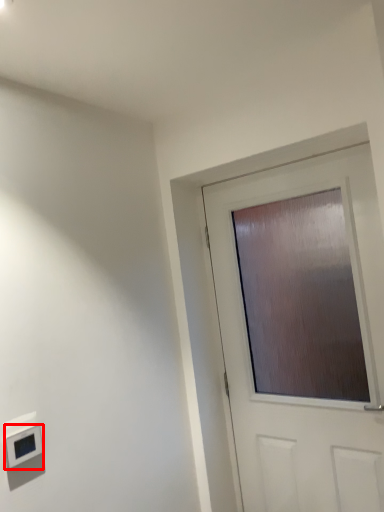
Question: From the image's perspective, what is the correct spatial relationship of light switch (annotated by the red box) in relation to door?

Choices:
 (A) above
 (B) below

Answer: (B)